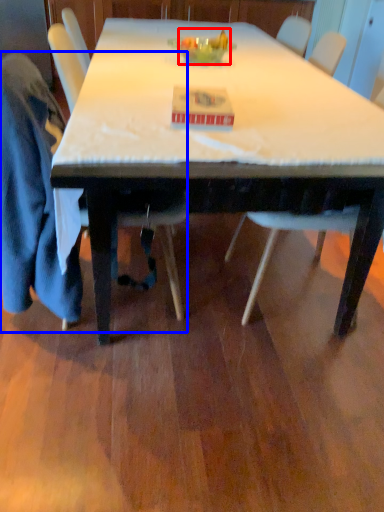
Question: Which object is further to the camera taking this photo, food (highlighted by a red box) or chair (highlighted by a blue box)?

Choices:
 (A) food
 (B) chair

Answer: (A)